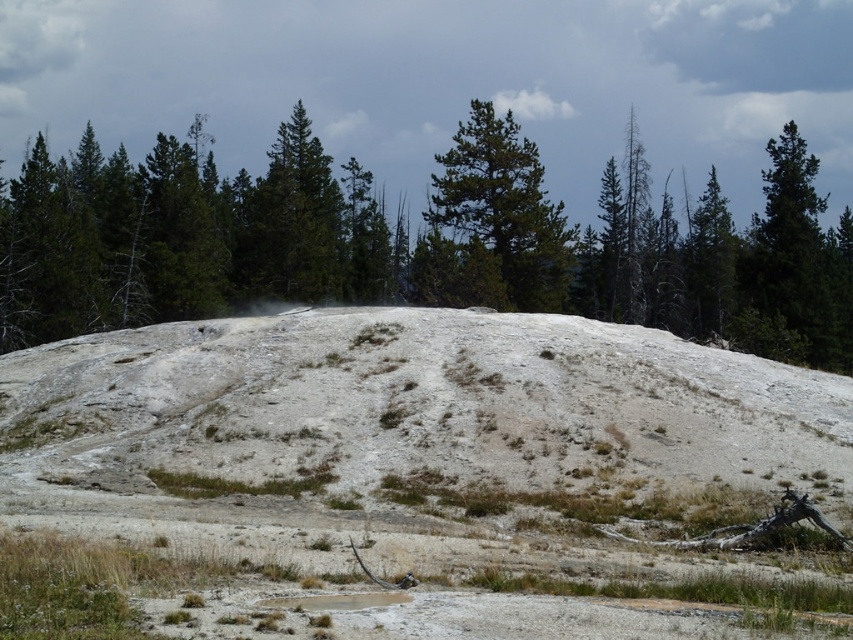
Is green textured tree at center shorter than green matte tree at center?

No, green textured tree at center is not shorter than green matte tree at center.

Does green textured tree at center have a greater width compared to green matte tree at center?

Indeed, green textured tree at center has a greater width compared to green matte tree at center.

Which is in front, point (573, 266) or point (509, 140)?

Point (509, 140) is more forward.

Where is `green textured tree at center`? This screenshot has height=640, width=853. green textured tree at center is located at coordinates (415, 243).